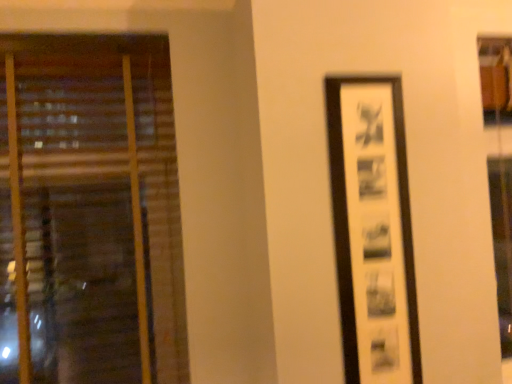
Question: Is wooden blinds at left far away from black matte picture frame at right?

Choices:
 (A) no
 (B) yes

Answer: (A)

Question: Is wooden blinds at left in front of black matte picture frame at right?

Choices:
 (A) no
 (B) yes

Answer: (A)

Question: Can you confirm if wooden blinds at left is smaller than black matte picture frame at right?

Choices:
 (A) yes
 (B) no

Answer: (B)

Question: Can you confirm if wooden blinds at left is shorter than black matte picture frame at right?

Choices:
 (A) yes
 (B) no

Answer: (B)

Question: Is wooden blinds at left taller than black matte picture frame at right?

Choices:
 (A) no
 (B) yes

Answer: (B)

Question: Is wooden blinds at left placed right next to black matte picture frame at right?

Choices:
 (A) no
 (B) yes

Answer: (A)

Question: Considering the relative sizes of black matte picture frame at right and wooden blinds at left in the image provided, is black matte picture frame at right thinner than wooden blinds at left?

Choices:
 (A) no
 (B) yes

Answer: (B)

Question: Is black matte picture frame at right smaller than wooden blinds at left?

Choices:
 (A) no
 (B) yes

Answer: (B)

Question: Considering the relative positions of black matte picture frame at right and wooden blinds at left in the image provided, is black matte picture frame at right behind wooden blinds at left?

Choices:
 (A) yes
 (B) no

Answer: (B)

Question: Can you confirm if black matte picture frame at right is positioned to the left of wooden blinds at left?

Choices:
 (A) yes
 (B) no

Answer: (B)

Question: Does black matte picture frame at right have a greater height compared to wooden blinds at left?

Choices:
 (A) yes
 (B) no

Answer: (B)

Question: Considering the relative sizes of black matte picture frame at right and wooden blinds at left in the image provided, is black matte picture frame at right shorter than wooden blinds at left?

Choices:
 (A) no
 (B) yes

Answer: (B)

Question: From a real-world perspective, is black matte picture frame at right above or below wooden blinds at left?

Choices:
 (A) below
 (B) above

Answer: (A)